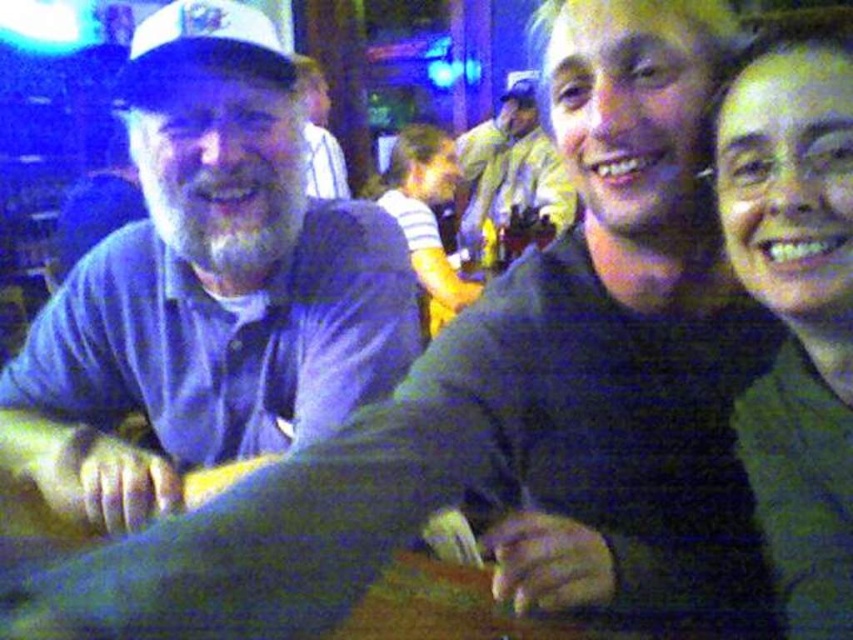
Question: Which of these objects is positioned closest to the matte white cap at upper left?

Choices:
 (A) yellowish-green jacket at center
 (B) blue cotton shirt at left
 (C) white matte baseball cap at upper left

Answer: (A)

Question: Observing the image, what is the correct spatial positioning of yellowish-green jacket at center in reference to matte white cap at upper left?

Choices:
 (A) right
 (B) left

Answer: (A)

Question: Is white matte baseball cap at upper left to the right of matte white cap at upper left from the viewer's perspective?

Choices:
 (A) no
 (B) yes

Answer: (B)

Question: Which point is farther to the camera?

Choices:
 (A) click(834, 179)
 (B) click(195, 208)

Answer: (B)

Question: Among these points, which one is farthest from the camera?

Choices:
 (A) (325, 180)
 (B) (817, 164)
 (C) (265, 83)
 (D) (566, 216)

Answer: (A)

Question: Does white matte baseball cap at upper left have a larger size compared to matte white cap at upper left?

Choices:
 (A) yes
 (B) no

Answer: (B)